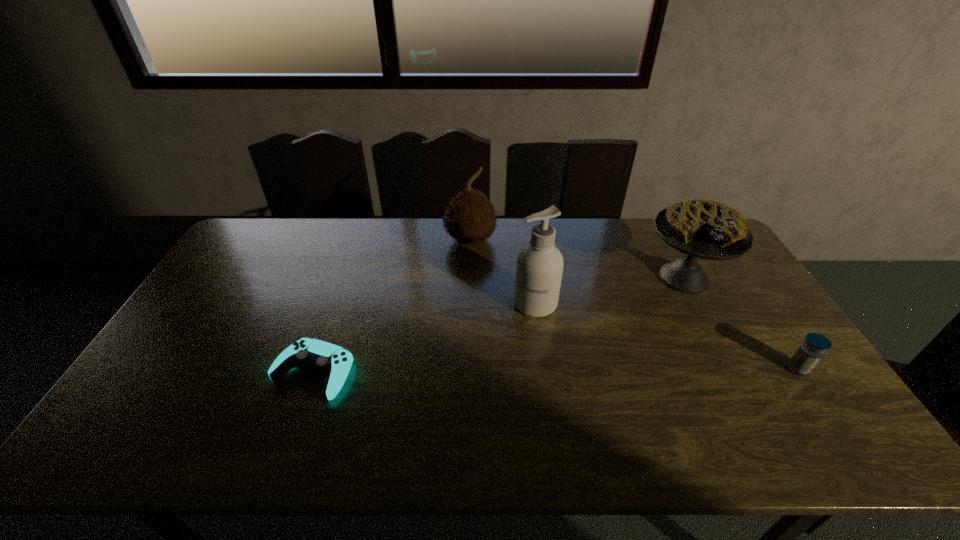
Locate an element on the screen. blank space at the near left corner is located at coordinates (147, 414).

At what (x,y) coordinates should I click in order to perform the action: click on empty location between the pie and the fourth object from right to left. Please return your answer as a coordinate pair (x, y). Looking at the image, I should click on (577, 259).

You are a GUI agent. You are given a task and a screenshot of the screen. Output one action in this format:
    pyautogui.click(x=<x>, y=<y>)
    Task: Click on the free space between the fourth tallest object and the second object from left to right
    This screenshot has width=960, height=540.
    Given the screenshot: What is the action you would take?
    pyautogui.click(x=635, y=305)

Locate an element on the screen. This screenshot has width=960, height=540. free space between the fourth object from left to right and the coconut is located at coordinates (577, 259).

I want to click on free space between the shortest object and the pie, so click(498, 325).

In order to click on vacant area that lies between the second object from right to left and the cleansing agent in this screenshot , I will do `click(610, 291)`.

Locate an element on the screen. free space between the fourth object from right to left and the leftmost object is located at coordinates (392, 306).

Locate an element on the screen. This screenshot has width=960, height=540. empty space between the cleansing agent and the control is located at coordinates (424, 338).

Locate an element on the screen. This screenshot has height=540, width=960. unoccupied position between the third object from left to right and the fourth object from right to left is located at coordinates (503, 272).

The height and width of the screenshot is (540, 960). I want to click on vacant space in between the leftmost object and the pie, so pos(498,325).